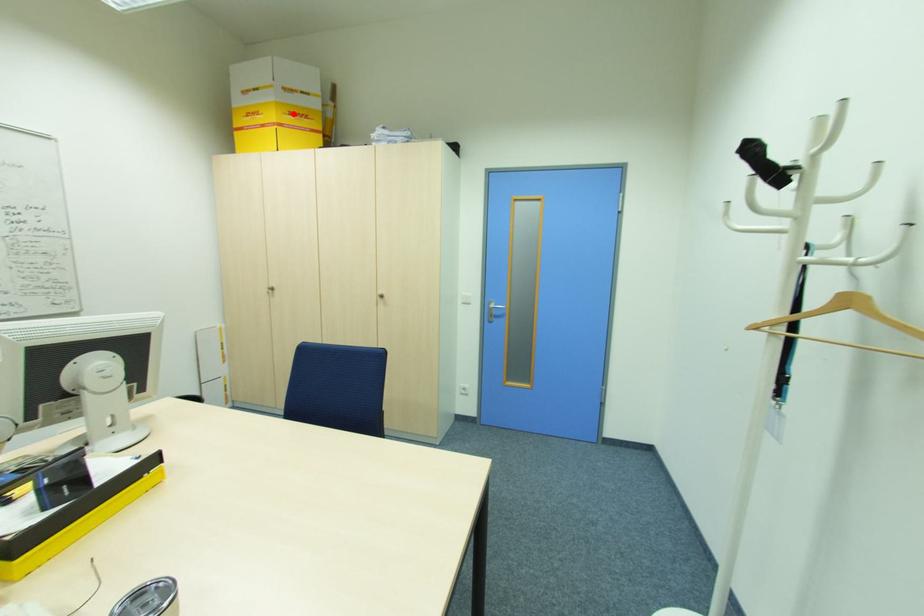
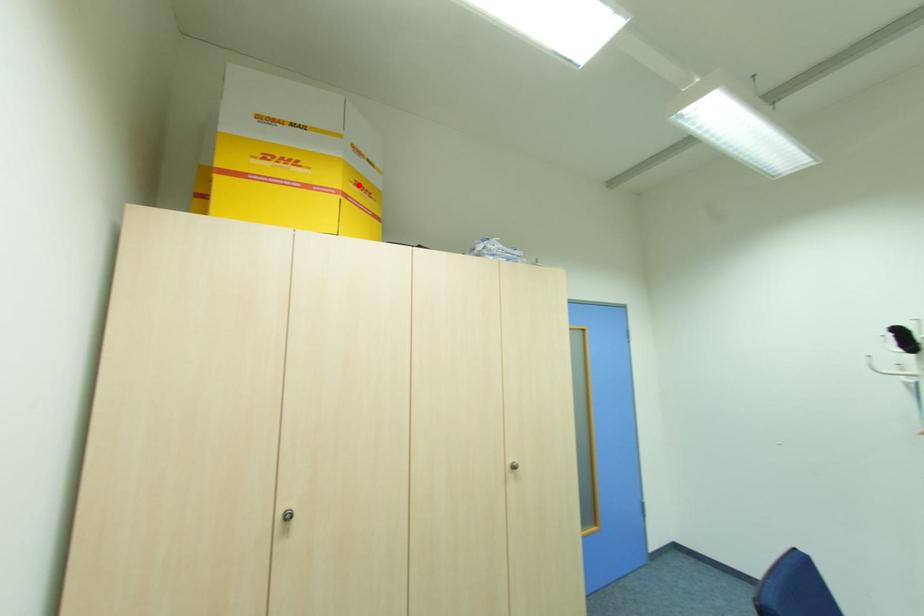
I am providing you with two images of the same scene from different viewpoints. A red point is marked on the first image and another point is marked on the second image. Is the marked point in image1 the same physical position as the marked point in image2?

Yes